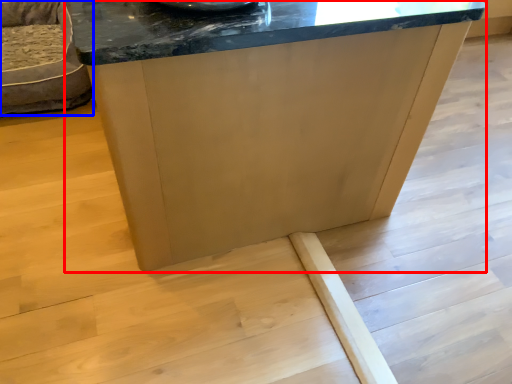
Question: Which object is closer to the camera taking this photo, table (highlighted by a red box) or furniture (highlighted by a blue box)?

Choices:
 (A) table
 (B) furniture

Answer: (A)